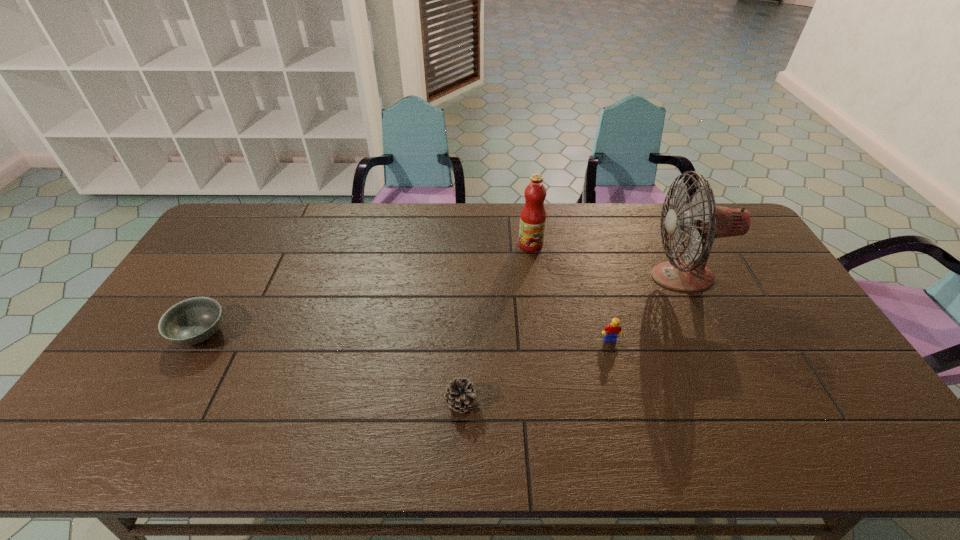
Locate an element on the screen. Image resolution: width=960 pixels, height=540 pixels. free area in between the fourth shortest object and the fan is located at coordinates (607, 260).

I want to click on vacant area that lies between the pinecone and the fruit juice, so click(x=495, y=323).

Identify the location of the fourth closest object to the leftmost object. This screenshot has height=540, width=960. (705, 220).

Identify which object is located as the third nearest to the third object from right to left. Please provide its 2D coordinates. Your answer should be formatted as a tuple, i.e. [(x, y)], where the tuple contains the x and y coordinates of a point satisfying the conditions above.

[(461, 395)]